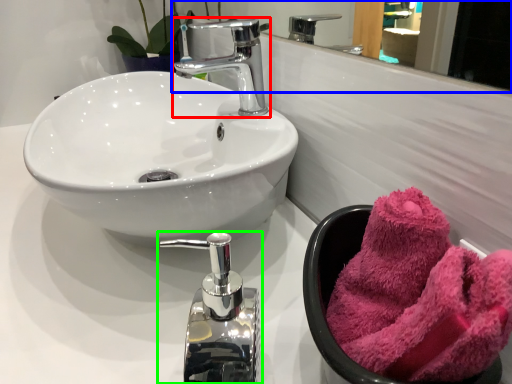
Question: Which object is the closest to the tap (highlighted by a red box)? Choose among these: mirror (highlighted by a blue box) or tap (highlighted by a green box).

Choices:
 (A) mirror
 (B) tap

Answer: (B)